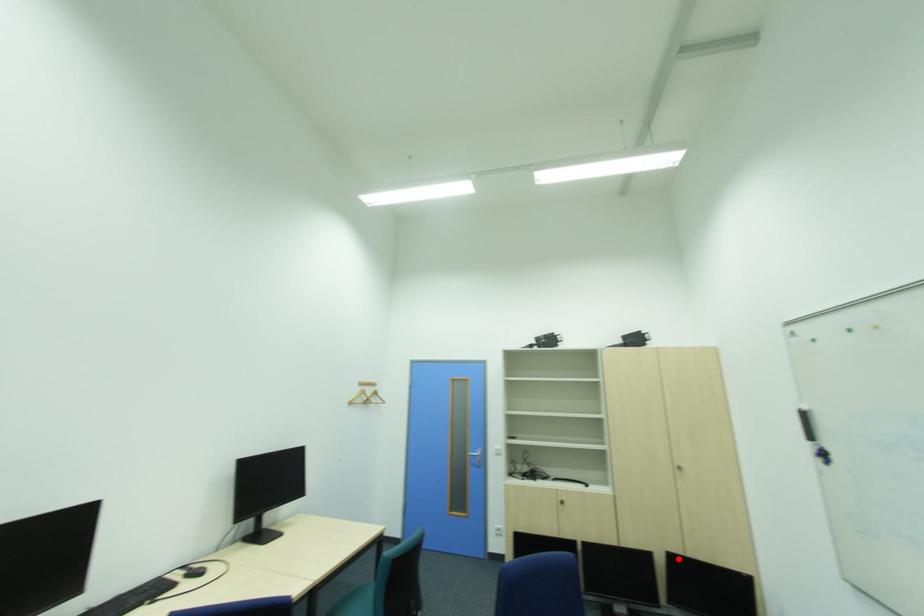
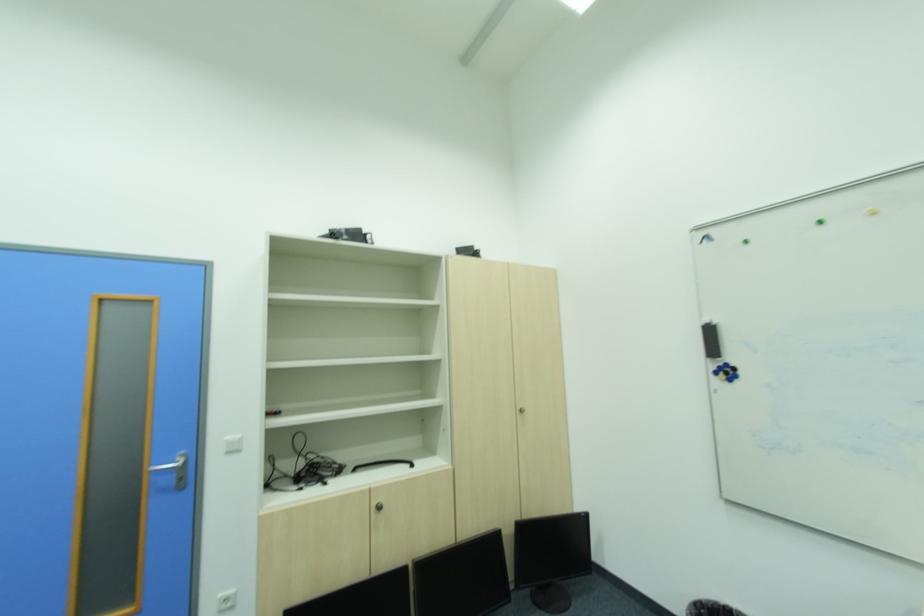
In the second image, find the point that corresponds to the highlighted location in the first image.

(531, 531)